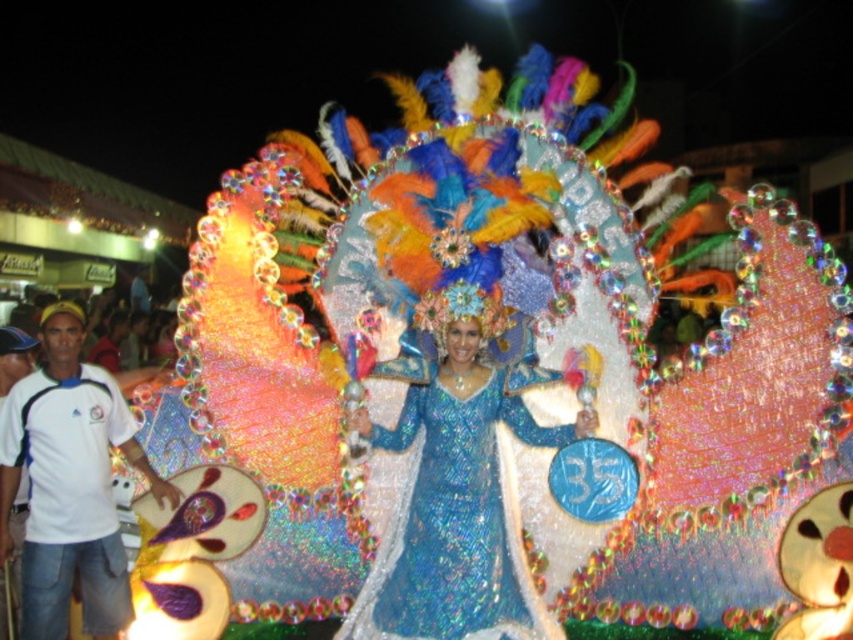
You are a photographer at the event and want to capture both the shiny blue dress at center and the white cotton shirt at lower left in a single shot. Based on their positions, which direction should you move your camera to include both subjects?

To include both the shiny blue dress at center and the white cotton shirt at lower left in your shot, you should move your camera to the left since the shiny blue dress at center is to the right of the white cotton shirt at lower left.

You are a photographer positioned at the scene. You want to capture a photo that includes both the shiny blue dress at center and the white cotton shirt at left. Given that your camera has a maximum focus range of 35 meters, will you be able to include both subjects in the same frame without moving your position?

The shiny blue dress at center is 39.43 meters from the white cotton shirt at left. Since the distance between them exceeds the camera maximum focus range of 35 meters, you cannot include both subjects in the same frame without moving your position.

You are standing in the crowd watching the parade float. There are two points marked on the float at coordinates point (582,426) and point (24,468). Which point is closer to you?

Point (582,426) is closer to the viewer than point (24,468).